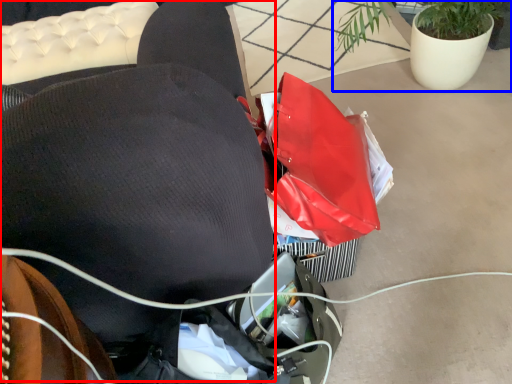
Question: Which point is further to the camera, bean bag chair (highlighted by a red box) or houseplant (highlighted by a blue box)?

Choices:
 (A) bean bag chair
 (B) houseplant

Answer: (B)